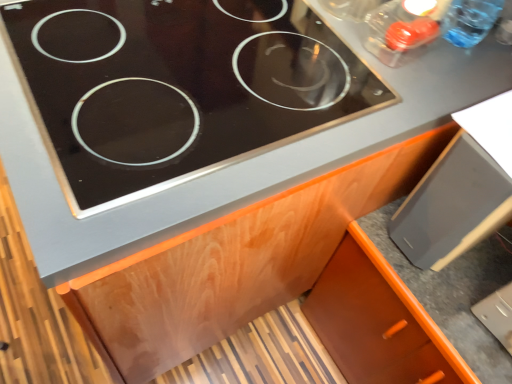
Locate an element on the screen. This screenshot has width=512, height=384. free space in front of matte black drawer at lower right is located at coordinates (449, 303).